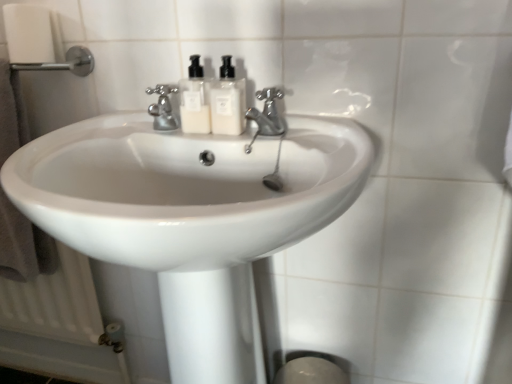
Question: Could you tell me if white plastic soap dispenser at center, which appears as the first soap dispenser when viewed from the left, is facing brown towel at left?

Choices:
 (A) no
 (B) yes

Answer: (A)

Question: From a real-world perspective, is white plastic soap dispenser at center, which appears as the first soap dispenser when viewed from the left, positioned under brown towel at left based on gravity?

Choices:
 (A) yes
 (B) no

Answer: (B)

Question: From the image's perspective, is white plastic soap dispenser at center, which is the second soap dispenser in right-to-left order, over brown towel at left?

Choices:
 (A) yes
 (B) no

Answer: (A)

Question: Is the depth of white plastic soap dispenser at center, which is the second soap dispenser in right-to-left order, less than that of brown towel at left?

Choices:
 (A) yes
 (B) no

Answer: (A)

Question: Is white plastic soap dispenser at center, which is the second soap dispenser in right-to-left order, further to camera compared to brown towel at left?

Choices:
 (A) no
 (B) yes

Answer: (A)

Question: Can you confirm if white plastic soap dispenser at center, which appears as the first soap dispenser when viewed from the left, is thinner than brown towel at left?

Choices:
 (A) yes
 (B) no

Answer: (A)

Question: Is white glossy sink at center not close to satin nickel faucet at center, which appears as the second tap when viewed from the left?

Choices:
 (A) no
 (B) yes

Answer: (A)

Question: Is white glossy sink at center behind satin nickel faucet at center, which is the 1th tap from right to left?

Choices:
 (A) yes
 (B) no

Answer: (B)

Question: Can you confirm if white glossy sink at center is shorter than satin nickel faucet at center, which is the 1th tap from right to left?

Choices:
 (A) yes
 (B) no

Answer: (B)

Question: Is satin nickel faucet at center, which appears as the second tap when viewed from the left, at the back of white glossy sink at center?

Choices:
 (A) yes
 (B) no

Answer: (B)

Question: Is white glossy sink at center beside satin nickel faucet at center, which appears as the second tap when viewed from the left?

Choices:
 (A) yes
 (B) no

Answer: (B)

Question: From a real-world perspective, is white glossy sink at center physically above satin nickel faucet at center, which appears as the second tap when viewed from the left?

Choices:
 (A) yes
 (B) no

Answer: (B)

Question: From the image's perspective, is white glossy soap dispenser at center, positioned as the 1th soap dispenser in right-to-left order, below satin nickel faucet at center, which is the 1th tap from right to left?

Choices:
 (A) no
 (B) yes

Answer: (A)